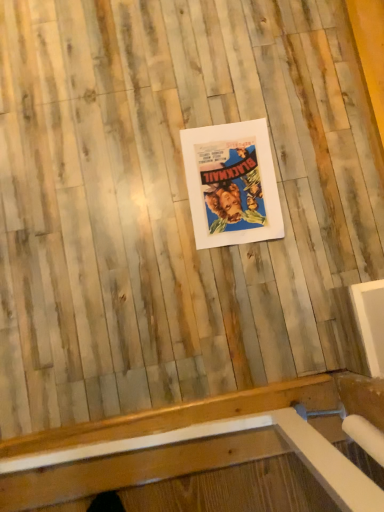
Find the location of a particular element. free space in front of white matte picture frame at center is located at coordinates (220, 283).